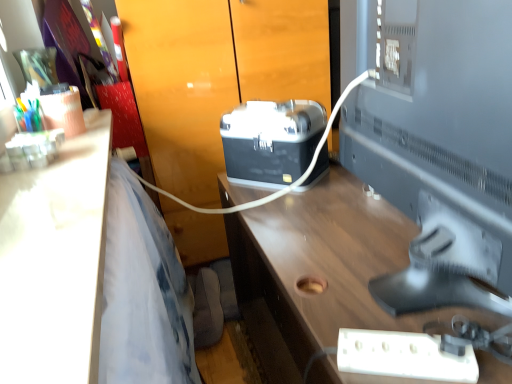
Question: From a real-world perspective, is matte black toolbox at center above or below black plastic projector at center?

Choices:
 (A) below
 (B) above

Answer: (A)

Question: Is matte black toolbox at center spatially inside black plastic projector at center, or outside of it?

Choices:
 (A) outside
 (B) inside

Answer: (A)

Question: Which of these objects is positioned farthest from the matte black toolbox at center?

Choices:
 (A) white glossy desk at left, the second desk viewed from the right
 (B) white plastic extension cord at lower right
 (C) satin silver monitor at right
 (D) black plastic projector at center
 (E) wooden desk at center, which is the first desk in right-to-left order

Answer: (B)

Question: Based on their relative distances, which object is nearer to the satin silver monitor at right?

Choices:
 (A) matte black toolbox at center
 (B) white plastic extension cord at lower right
 (C) wooden desk at center, the second desk from the left
 (D) white glossy desk at left, which is the first desk from left to right
 (E) black plastic projector at center

Answer: (C)